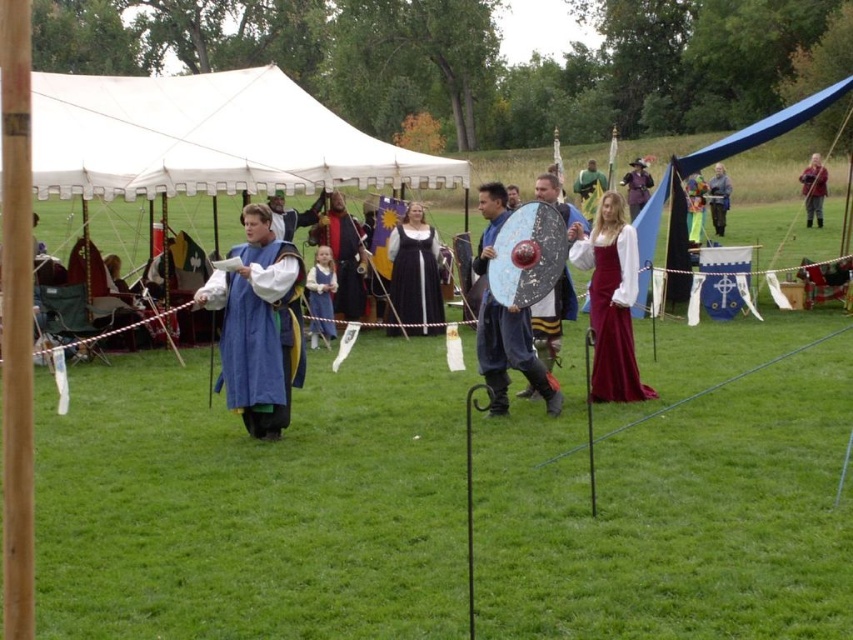
Question: Can you confirm if shiny metallic shield at center is positioned above green velvet dress at center?

Choices:
 (A) yes
 (B) no

Answer: (B)

Question: Does matte black dress at center lie in front of silky red dress at center?

Choices:
 (A) no
 (B) yes

Answer: (B)

Question: Considering the real-world distances, which object is farthest from the purple velvet hat at upper center?

Choices:
 (A) white canvas canopy at upper center
 (B) shiny metallic shield at center
 (C) blue velvet dress at center
 (D) gray woolen coat at upper right

Answer: (B)

Question: Which point appears farthest from the camera in this image?

Choices:
 (A) pyautogui.click(x=396, y=262)
 (B) pyautogui.click(x=554, y=177)

Answer: (A)

Question: Among these objects, which one is farthest from the camera?

Choices:
 (A) blue velvet dress at center
 (B) silky red dress at center
 (C) light blue fabric dress at center

Answer: (B)

Question: Does blue velvet cape at upper right have a smaller size compared to green velvet dress at center?

Choices:
 (A) no
 (B) yes

Answer: (A)